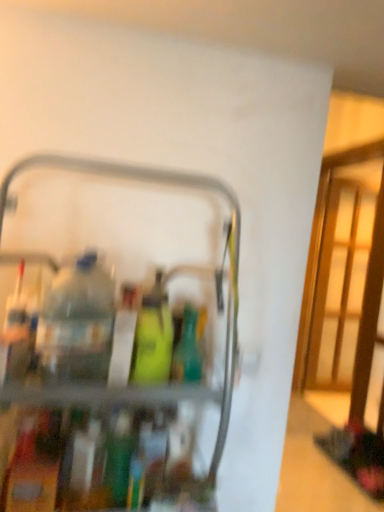
Question: Is green matte bottle at center, which ranks as the 3th bottle in top-to-bottom order, to the left or to the right of green matte bottle at center, positioned as the 2th bottle in bottom-to-top order, in the image?

Choices:
 (A) left
 (B) right

Answer: (A)

Question: In terms of width, does green matte bottle at center, which ranks as the 3th bottle in top-to-bottom order, look wider or thinner when compared to green matte bottle at center, placed as the 2th bottle when sorted from top to bottom?

Choices:
 (A) thin
 (B) wide

Answer: (A)

Question: Estimate the real-world distances between objects in this image. Which object is closer to the green matte bottle at center, placed as the 2th bottle when sorted from top to bottom?

Choices:
 (A) green matte bottle at center, which ranks as the 3th bottle in top-to-bottom order
 (B) metallic gray cart at center
 (C) green matte bottle at center, which is the 1th bottle in top-to-bottom order

Answer: (C)

Question: Which object is positioned closest to the green matte bottle at center, placed as the 2th bottle when sorted from top to bottom?

Choices:
 (A) green matte bottle at center, arranged as the third bottle when ordered from the bottom
 (B) green matte bottle at center, which ranks as the 3th bottle in top-to-bottom order
 (C) metallic gray cart at center

Answer: (A)